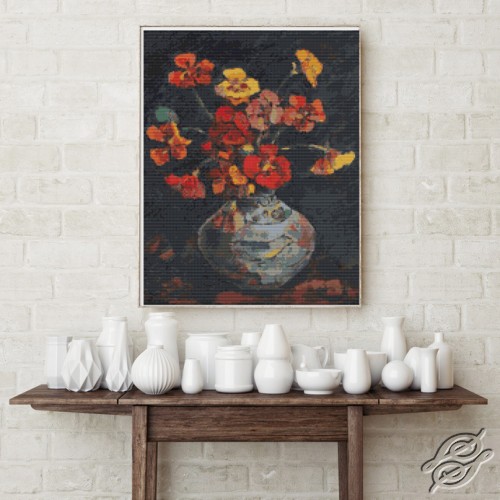
In order to click on vase in this screenshot , I will do `click(395, 338)`.